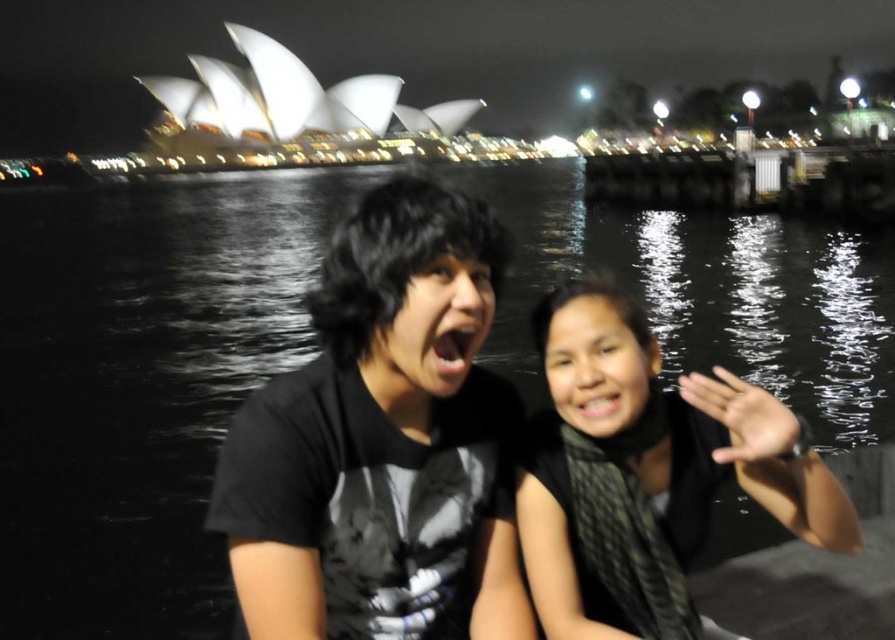
You are a photographer trying to capture both the black matte shirt at center and the black silk scarf at lower right in a single frame. Which object should you focus on first to ensure both are in the frame without moving the camera?

Since the black matte shirt at center is larger in size than the black silk scarf at lower right, you should focus on the black matte shirt at center first to ensure it fits within the frame, and the smaller black silk scarf at lower right will naturally be included as well.

You are a photographer trying to capture a photo of both the black matte shirt at center and the black silk scarf at lower right. Since you want to ensure both are clearly visible in the frame, which object should you focus on first to account for their sizes?

The black matte shirt at center is much taller than the black silk scarf at lower right, so you should focus on the black matte shirt at center first to ensure its details are captured clearly before adjusting for the smaller object.

You are a photographer trying to capture the Sydney Opera House in the background while focusing on the two people in the foreground. You notice the black matte shirt at center and the black silk scarf at lower right. Which clothing item appears narrower in your photo?

The black matte shirt at center appears narrower in the photo because it has a lesser width compared to the black silk scarf at lower right.